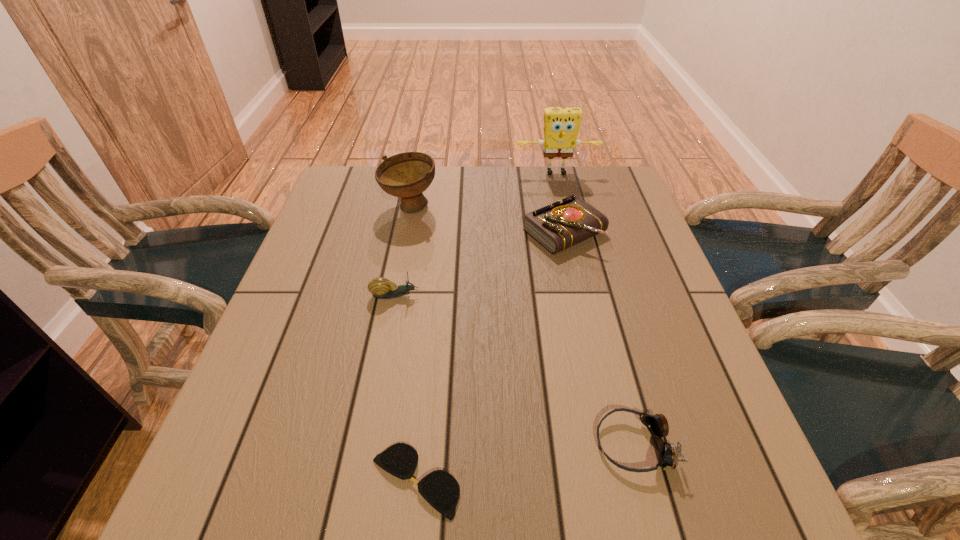
You are a GUI agent. You are given a task and a screenshot of the screen. Output one action in this format:
    pyautogui.click(x=<x>, y=<y>)
    Task: Click on the unoccupied position between the soup bowl and the shortest object
    This screenshot has width=960, height=540.
    Given the screenshot: What is the action you would take?
    pyautogui.click(x=413, y=344)

Locate an element on the screen. Image resolution: width=960 pixels, height=540 pixels. object that can be found as the fourth closest to the second shortest object is located at coordinates (406, 175).

This screenshot has width=960, height=540. I want to click on object that can be found as the fourth closest to the sponge, so click(657, 424).

Where is `vacant space that satisfies the following two spatial constraints: 1. through the lenses of the fifth tallest object; 2. on the front side of the spectacles`? vacant space that satisfies the following two spatial constraints: 1. through the lenses of the fifth tallest object; 2. on the front side of the spectacles is located at coordinates (643, 481).

Locate an element on the screen. vacant position in the image that satisfies the following two spatial constraints: 1. on the face of the farthest object; 2. on the front-facing side of the escargot is located at coordinates (585, 295).

Locate an element on the screen. vacant region that satisfies the following two spatial constraints: 1. on the front-facing side of the spectacles; 2. on the left side of the escargot is located at coordinates (360, 481).

Locate an element on the screen. The image size is (960, 540). free spot that satisfies the following two spatial constraints: 1. on the front side of the fifth shortest object; 2. on the right side of the diary is located at coordinates pyautogui.click(x=405, y=232).